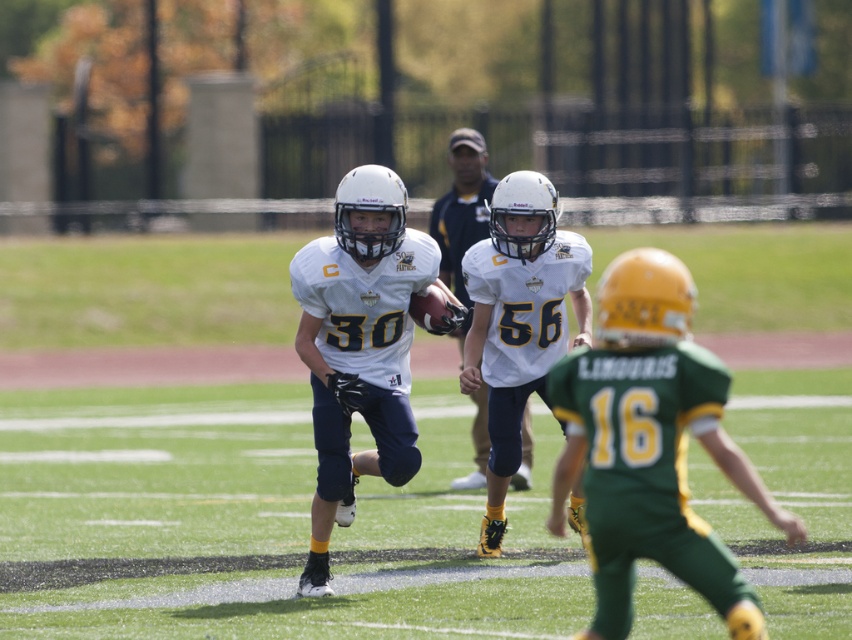
Consider the image. You are a photographer standing at the center of the field. You want to take a photo of both the point at point (x=551, y=492) and point (x=429, y=282). Which point is closer to your camera?

Point (x=429, y=282) is closer to the camera because it is closer to the photographer than point (x=551, y=492), which is further away.